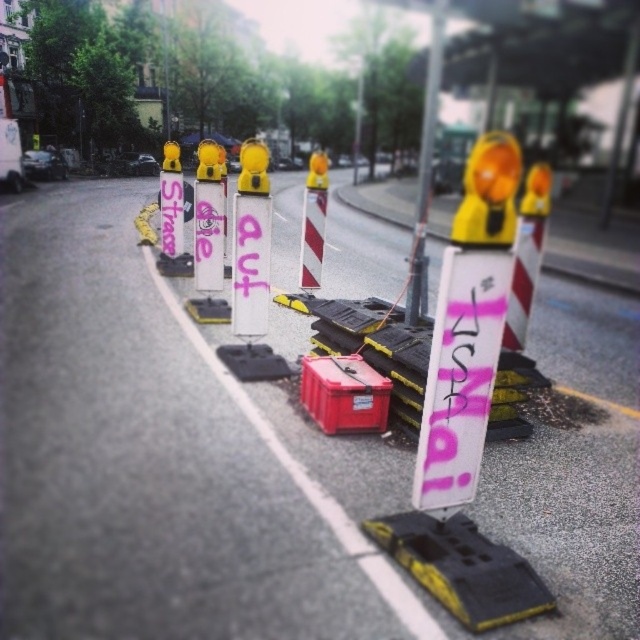
You are a pedestrian standing on the sidewalk and want to cross the road. You see a white plastic pole at center and a dark gray metallic car at center. Which object is closer to you?

The white plastic pole at center has a larger size compared to dark gray metallic car at center, so the pole is closer to you since larger objects appear bigger when they are nearer.

You are driving a dark gray metallic car at center and want to read the pink matte sign at center. Can you see the entire sign from your current position?

The pink matte sign at center is in front of the dark gray metallic car at center, so the driver cannot see the entire sign because it is blocked by the car itself.

Looking at this image, you are standing on the road and see two points marked on the ground in front of you. The first point is at coordinates point (436, 13) and the second is at point (138, 170). Which point is closer to you?

Point (436, 13) is closer to the viewer than point (138, 170).